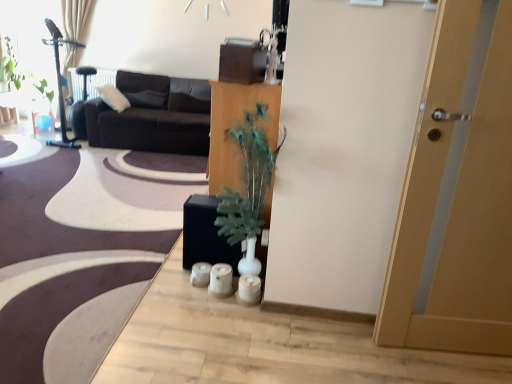
Question: Is dark brown fabric couch at upper left taller or shorter than wooden cabinet at center?

Choices:
 (A) tall
 (B) short

Answer: (B)

Question: Based on their sizes in the image, would you say dark brown fabric couch at upper left is bigger or smaller than wooden cabinet at center?

Choices:
 (A) big
 (B) small

Answer: (A)

Question: Which object is the closest to the green leafy plant at upper left?

Choices:
 (A) wooden cabinet at center
 (B) light brown wood door at right
 (C) black matte speaker at lower left
 (D) dark brown fabric couch at upper left
 (E) transparent glass window screen at upper left

Answer: (E)

Question: Estimate the real-world distances between objects in this image. Which object is closer to the light brown wood door at right?

Choices:
 (A) black matte speaker at lower left
 (B) wooden cabinet at center
 (C) white soft pillow at upper left
 (D) green leafy plant at upper left
 (E) transparent glass window screen at upper left

Answer: (B)